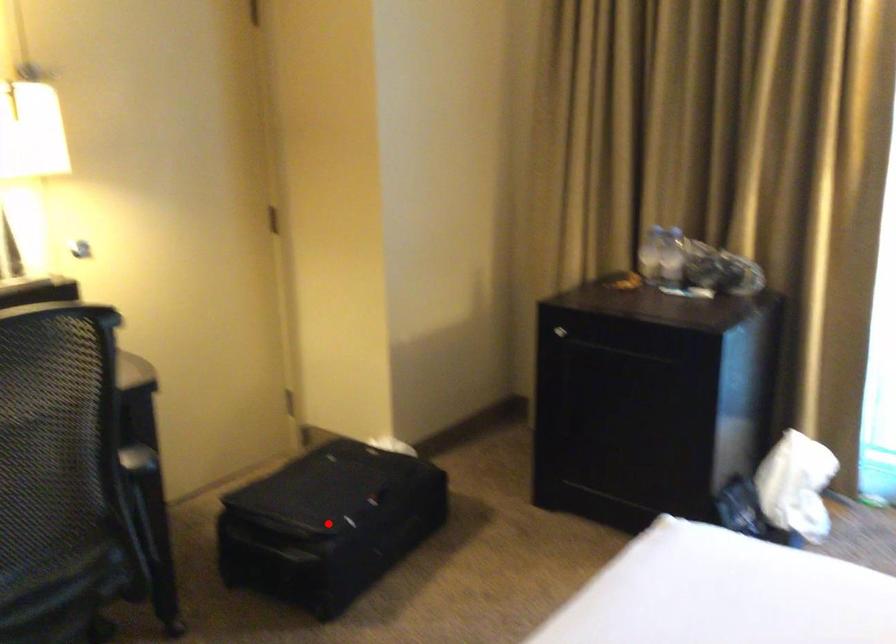
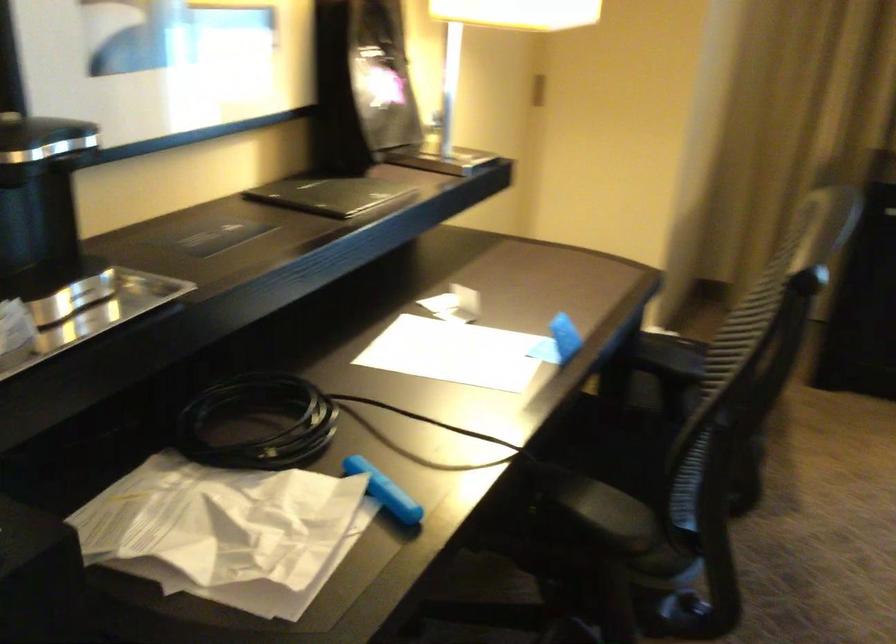
Question: I am providing you with two images of the same scene from different viewpoints. A red point is marked on the first image. Is the red point's position out of view in image 2?

Choices:
 (A) Yes
 (B) No

Answer: (A)